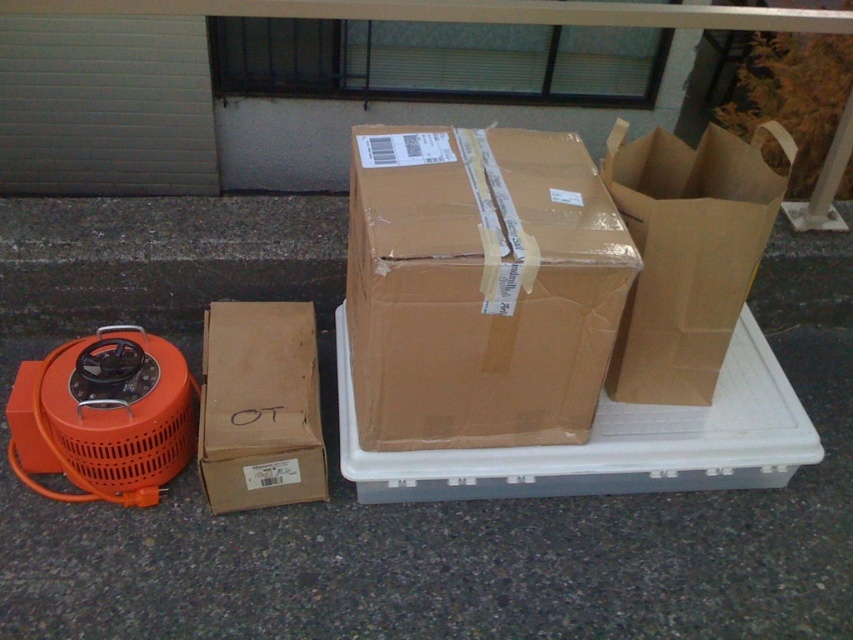
Is brown cardboard box at center thinner than brown cardboard box at lower left?

No.

This screenshot has height=640, width=853. Identify the location of brown cardboard box at center. (479, 288).

Between brown cardboard box at center and brown paper bag at upper right, which one appears on the left side from the viewer's perspective?

Answer: brown cardboard box at center

Which of these two, brown cardboard box at center or brown paper bag at upper right, stands shorter?

brown paper bag at upper right

Who is more distant from viewer, (467, 230) or (788, 164)?

Point (788, 164)

This screenshot has height=640, width=853. What are the coordinates of `brown cardboard box at center` in the screenshot? It's located at (479, 288).

Does brown paper bag at upper right appear over brown cardboard box at lower left?

Yes, brown paper bag at upper right is above brown cardboard box at lower left.

Is brown paper bag at upper right taller than brown cardboard box at lower left?

Yes, brown paper bag at upper right is taller than brown cardboard box at lower left.

Where is `brown paper bag at upper right`? This screenshot has width=853, height=640. brown paper bag at upper right is located at coordinates [688, 253].